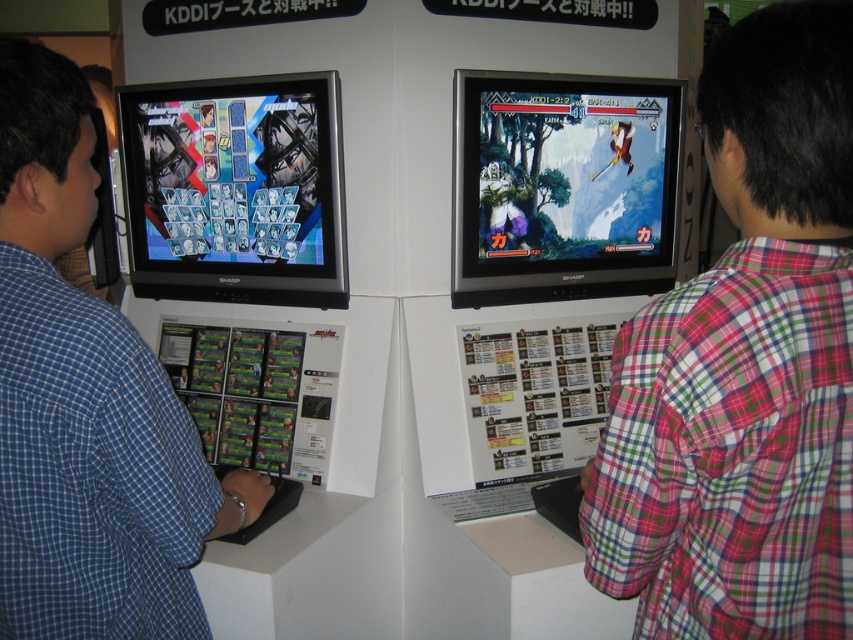
Question: Which point appears farthest from the camera in this image?

Choices:
 (A) (816, 320)
 (B) (144, 518)

Answer: (B)

Question: Does plaid shirt at right appear on the right side of blue plaid shirt at left?

Choices:
 (A) yes
 (B) no

Answer: (A)

Question: Can you confirm if plaid shirt at right is bigger than blue plaid shirt at left?

Choices:
 (A) no
 (B) yes

Answer: (A)

Question: Which point is closer to the camera taking this photo?

Choices:
 (A) (x=583, y=515)
 (B) (x=245, y=476)

Answer: (A)

Question: From the image, what is the correct spatial relationship of plaid shirt at right in relation to blue plaid shirt at left?

Choices:
 (A) left
 (B) right

Answer: (B)